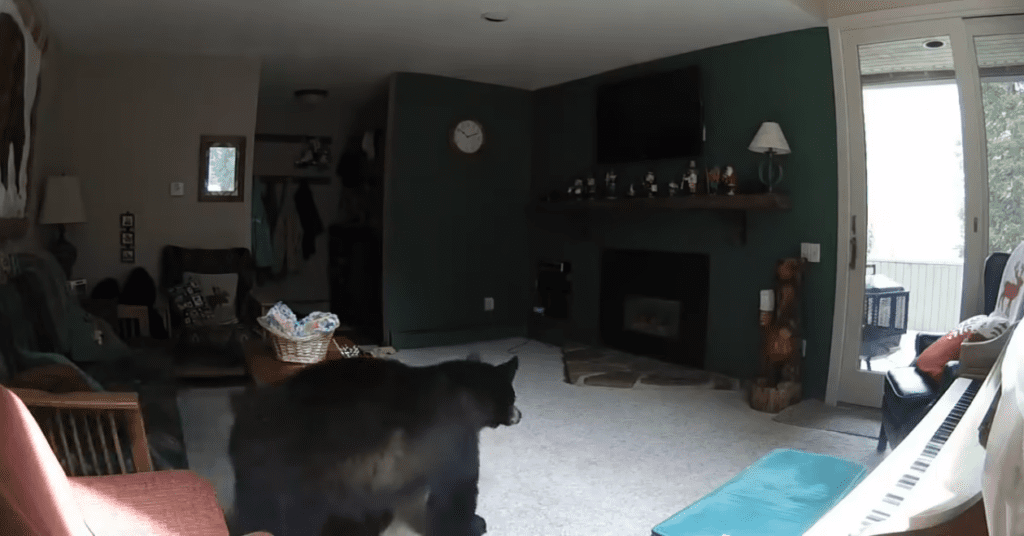
Where is `blue piano bench cushion`? blue piano bench cushion is located at coordinates (755, 496).